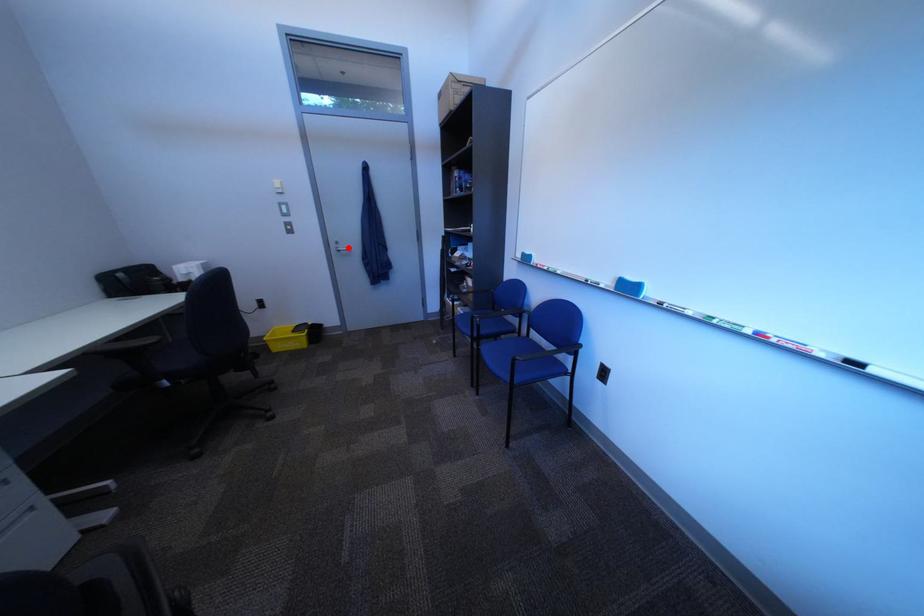
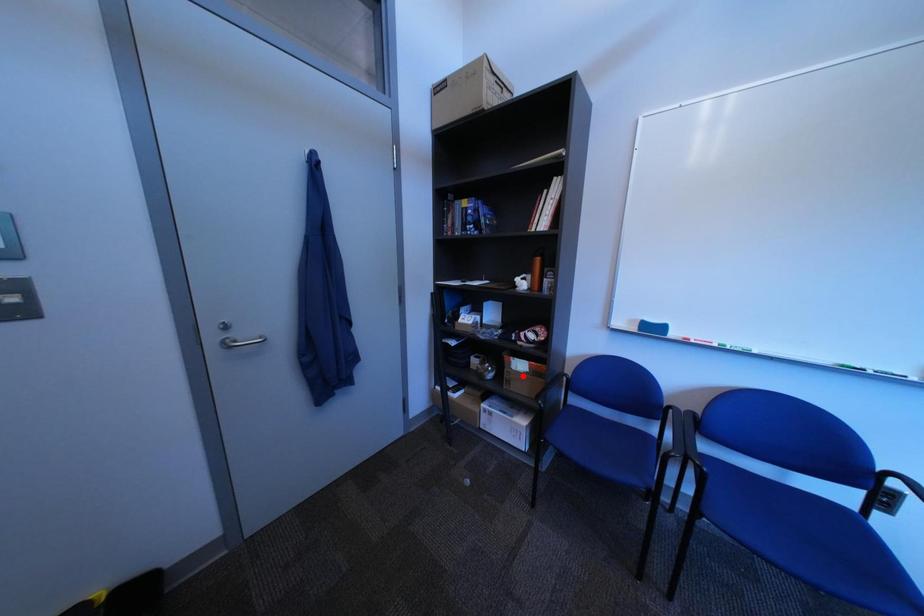
I am providing you with two images of the same scene from different viewpoints. A red point is marked on the first image and another point is marked on the second image. Do the highlighted points in image1 and image2 indicate the same real-world spot?

No